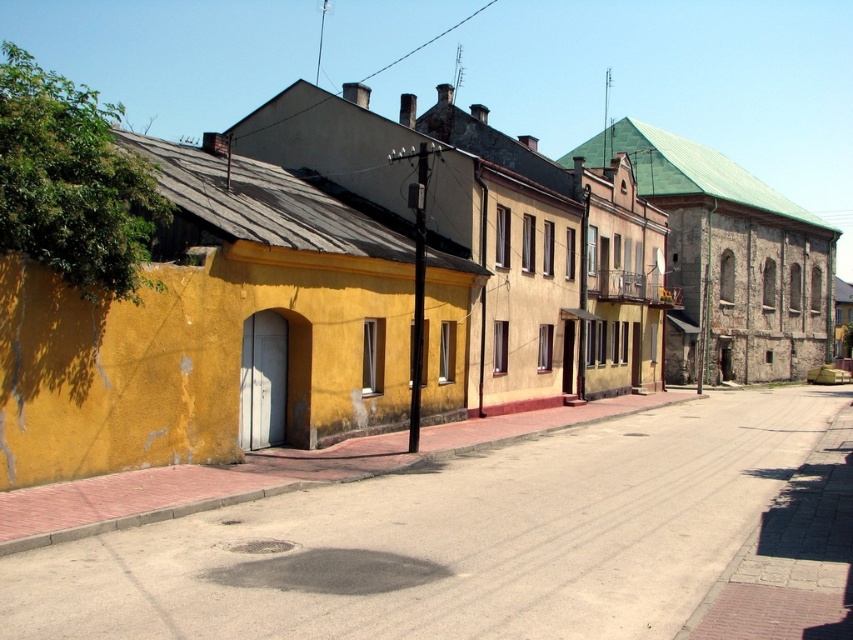
Question: Can you confirm if yellow matte building at left is positioned above smooth concrete alley at center?

Choices:
 (A) no
 (B) yes

Answer: (B)

Question: Which object appears farthest from the camera in this image?

Choices:
 (A) yellow matte building at left
 (B) smooth concrete alley at center

Answer: (A)

Question: Considering the relative positions of yellow matte building at left and smooth concrete alley at center in the image provided, where is yellow matte building at left located with respect to smooth concrete alley at center?

Choices:
 (A) left
 (B) right

Answer: (B)

Question: Which object is closer to the camera taking this photo?

Choices:
 (A) smooth concrete alley at center
 (B) yellow matte building at left

Answer: (A)

Question: Can you confirm if yellow matte building at left is positioned to the left of smooth concrete alley at center?

Choices:
 (A) yes
 (B) no

Answer: (B)

Question: Which object appears farthest from the camera in this image?

Choices:
 (A) smooth concrete alley at center
 (B) yellow matte building at left

Answer: (B)